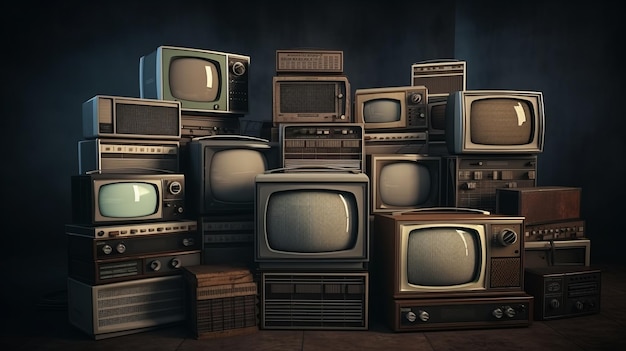
The height and width of the screenshot is (351, 626). Identify the location of tvs. (446, 264), (489, 134), (394, 191), (393, 120), (304, 95), (317, 210), (226, 162), (126, 202), (180, 78).